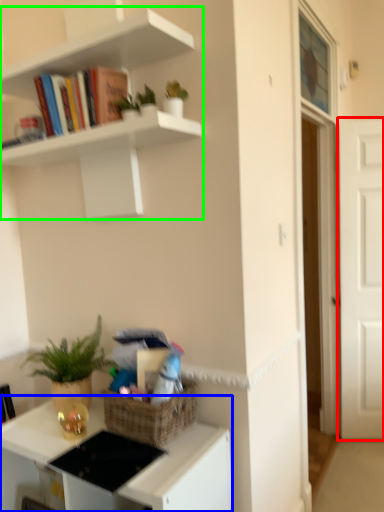
Question: Based on their relative distances, which object is nearer to door (highlighted by a red box)? Choose from desk (highlighted by a blue box) and shelf (highlighted by a green box).

Choices:
 (A) desk
 (B) shelf

Answer: (B)